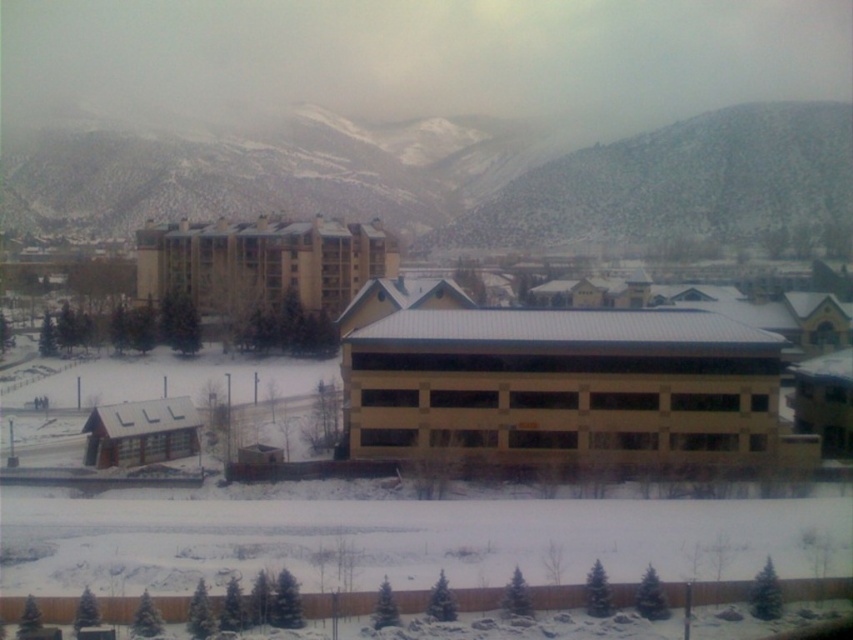
Consider the image. Does beige concrete hotel at center have a greater width compared to matte brown cabin at lower left?

Indeed, beige concrete hotel at center has a greater width compared to matte brown cabin at lower left.

Is point (244, 236) in front of point (94, 419)?

No, (244, 236) is behind (94, 419).

This screenshot has width=853, height=640. In order to click on beige concrete hotel at center in this screenshot , I will do (262, 262).

Which is above, beige concrete parking garage at center or matte brown cabin at lower left?

beige concrete parking garage at center is above.

Between beige concrete parking garage at center and matte brown cabin at lower left, which one has less height?

Standing shorter between the two is matte brown cabin at lower left.

Identify the location of beige concrete parking garage at center. (561, 388).

I want to click on beige concrete parking garage at center, so click(561, 388).

Can you confirm if snow-covered mountain at upper center is shorter than matte brown cabin at lower left?

No, snow-covered mountain at upper center is not shorter than matte brown cabin at lower left.

Image resolution: width=853 pixels, height=640 pixels. Describe the element at coordinates (461, 182) in the screenshot. I see `snow-covered mountain at upper center` at that location.

Locate an element on the screen. snow-covered mountain at upper center is located at coordinates (461, 182).